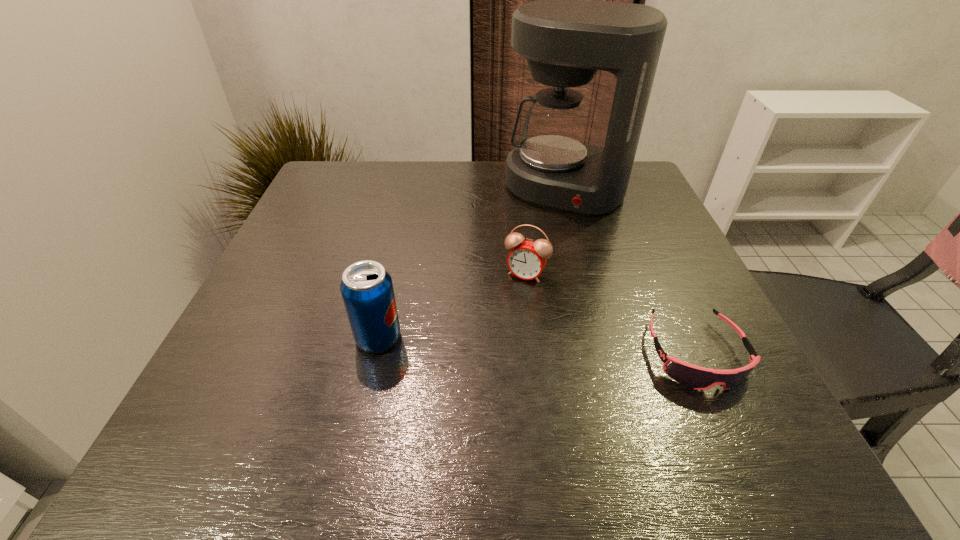
Find the location of a particular element. The width and height of the screenshot is (960, 540). free space located on the front-facing side of the tallest object is located at coordinates (520, 274).

In order to click on vacant space situated on the clock face of the second shortest object in this screenshot , I will do tap(467, 376).

This screenshot has height=540, width=960. In order to click on vacant space located 0.150m on the clock face of the second shortest object in this screenshot , I will do `click(490, 334)`.

Locate an element on the screen. The image size is (960, 540). vacant position located on the clock face of the second shortest object is located at coordinates (471, 367).

Locate an element on the screen. The height and width of the screenshot is (540, 960). object located at the far edge is located at coordinates (566, 36).

You are a GUI agent. You are given a task and a screenshot of the screen. Output one action in this format:
    pyautogui.click(x=<x>, y=<y>)
    Task: Click on the object that is at the near edge
    The image size is (960, 540).
    Given the screenshot: What is the action you would take?
    pyautogui.click(x=698, y=378)

Where is `goggles that is at the right edge`? The height and width of the screenshot is (540, 960). goggles that is at the right edge is located at coordinates (698, 378).

Identify the location of coffee maker that is at the right edge. This screenshot has width=960, height=540. (566, 36).

I want to click on object present at the far right corner, so click(566, 36).

I want to click on object that is at the near right corner, so click(698, 378).